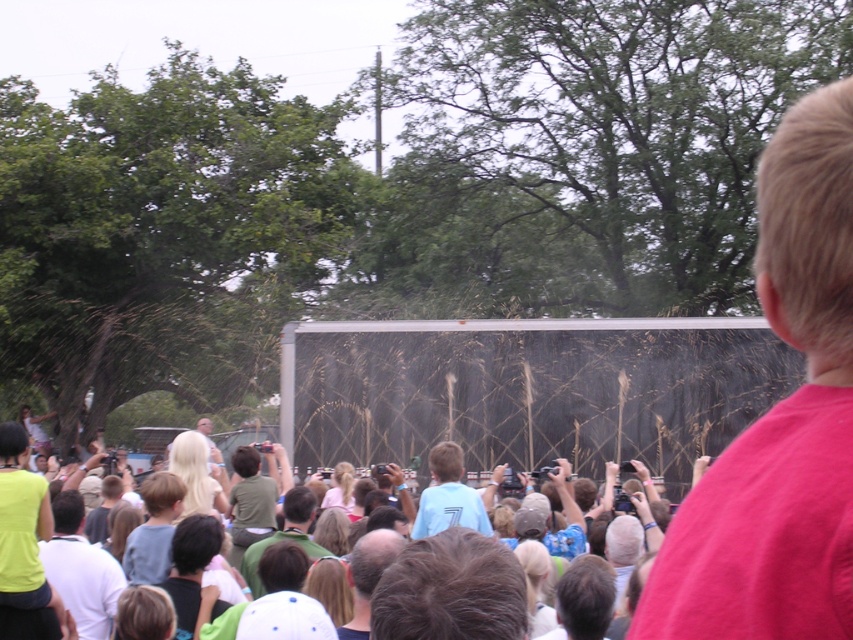
Question: Is pink cotton shirt at right positioned in front of dark brown hair at center?

Choices:
 (A) yes
 (B) no

Answer: (A)

Question: Among these objects, which one is farthest from the camera?

Choices:
 (A) pink cotton shirt at right
 (B) blue jersey at center
 (C) white matte shirt at lower left
 (D) green fabric shirt at center

Answer: (D)

Question: Does pink cotton shirt at right appear under white matte shirt at lower left?

Choices:
 (A) no
 (B) yes

Answer: (A)

Question: Does metallic silver water at center have a greater width compared to neon yellow shirt at lower left?

Choices:
 (A) no
 (B) yes

Answer: (B)

Question: Estimate the real-world distances between objects in this image. Which object is farther from the green fabric shirt at center?

Choices:
 (A) neon yellow shirt at lower left
 (B) pink cotton shirt at right
 (C) white matte shirt at lower left

Answer: (B)

Question: Based on their relative distances, which object is farther from the metallic silver water at center?

Choices:
 (A) blue jersey at center
 (B) neon yellow shirt at lower left
 (C) dark brown hair at center
 (D) green fabric shirt at center

Answer: (C)